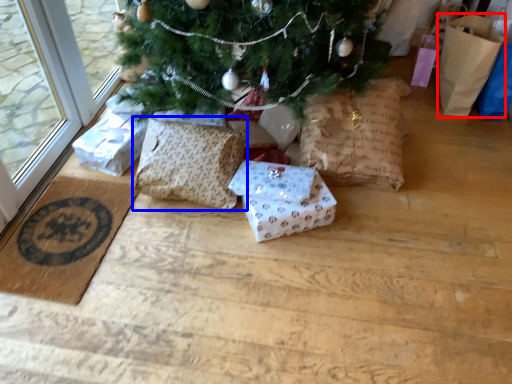
Question: Which object is further to the camera taking this photo, gift bag (highlighted by a red box) or pillow (highlighted by a blue box)?

Choices:
 (A) gift bag
 (B) pillow

Answer: (A)